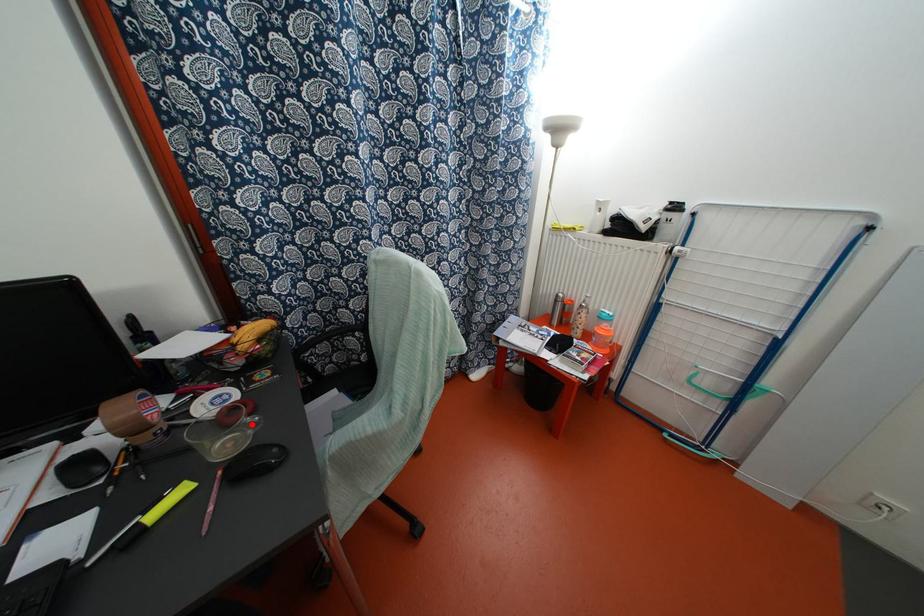
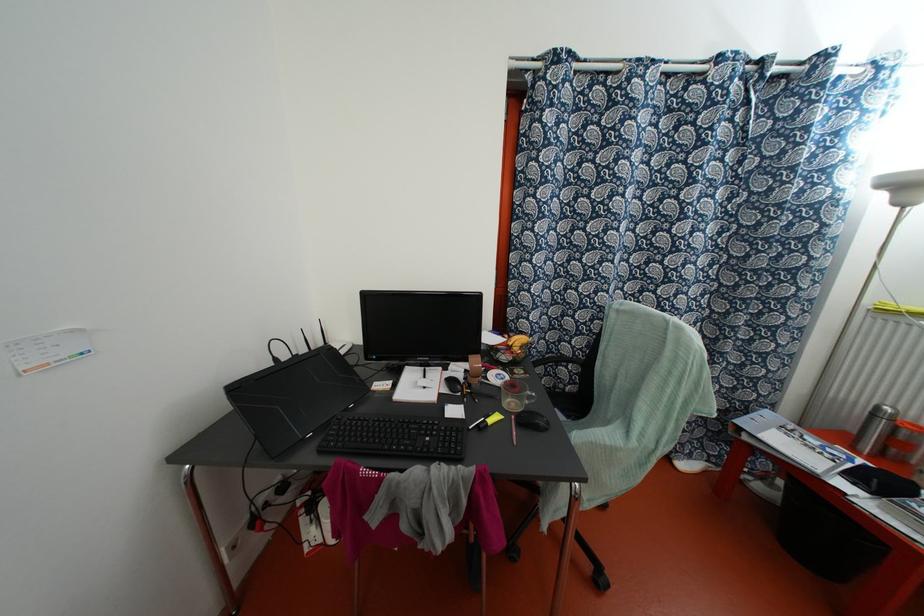
Locate, in the second image, the point that corresponds to the highlighted location in the first image.

(529, 397)